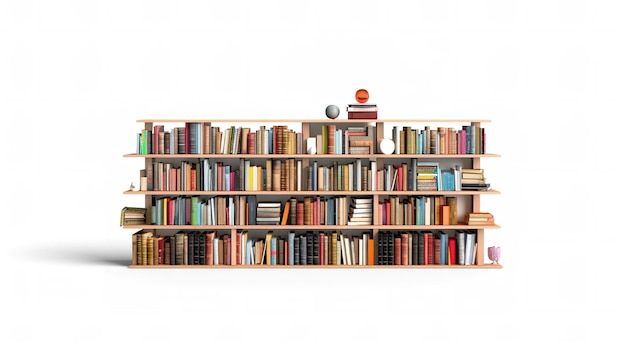
Find the how many spheres are located on this bookshelf in the image. Your answer should be formatted as a list of tuples, i.e. [(x1, y1), (x2, y2), ...], where each tuple contains the x and y coordinates of a point satisfying the conditions above.

[(360, 93), (332, 109), (310, 151), (387, 148)]